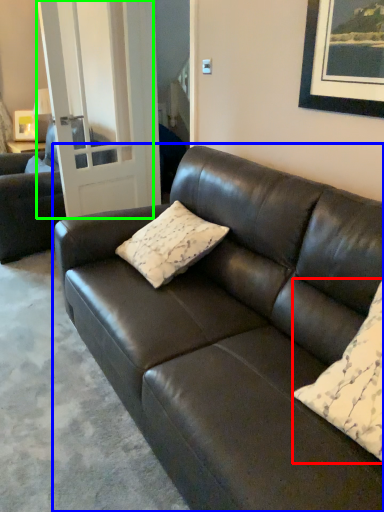
Question: Which is nearer to the pillow (highlighted by a red box)? studio couch (highlighted by a blue box) or glass door (highlighted by a green box).

Choices:
 (A) studio couch
 (B) glass door

Answer: (A)